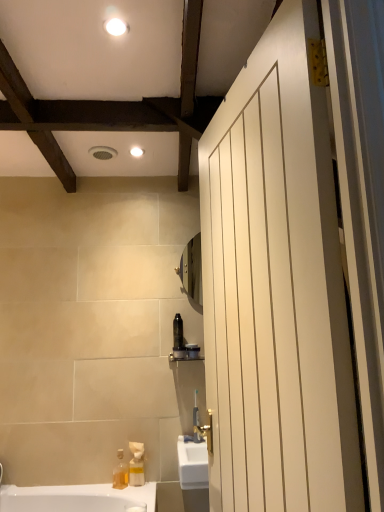
Where is `empty space that is to the right of white glossy light fixture at upper center, placed as the second light fixture when sorted from bottom to top`? empty space that is to the right of white glossy light fixture at upper center, placed as the second light fixture when sorted from bottom to top is located at coordinates (165, 27).